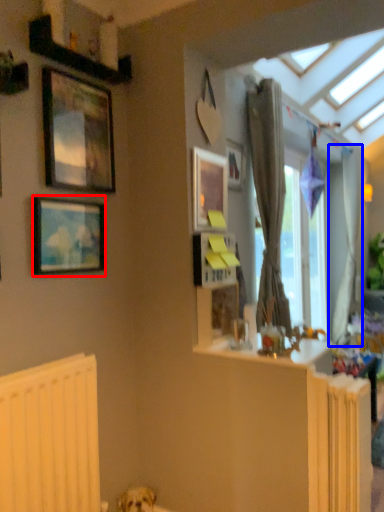
Question: Among these objects, which one is farthest to the camera, picture frame (highlighted by a red box) or curtain (highlighted by a blue box)?

Choices:
 (A) picture frame
 (B) curtain

Answer: (B)